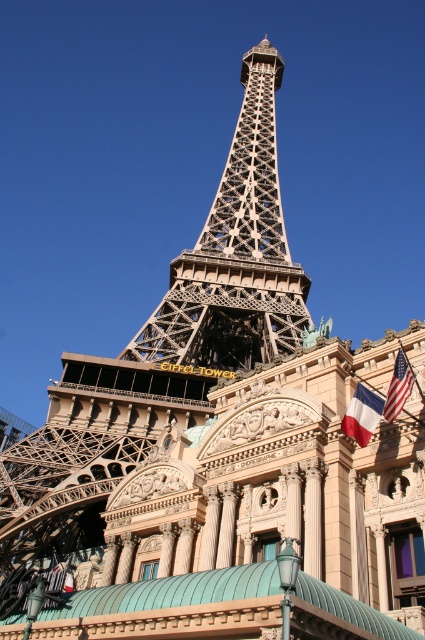
Does metallic lattice structure at center appear under american flag at upper right?

No, metallic lattice structure at center is not below american flag at upper right.

From the picture: Does metallic lattice structure at center have a lesser width compared to american flag at upper right?

In fact, metallic lattice structure at center might be wider than american flag at upper right.

Which is behind, point (260, 76) or point (391, 419)?

Positioned behind is point (260, 76).

Where is `metallic lattice structure at center`? This screenshot has height=640, width=425. metallic lattice structure at center is located at coordinates (235, 253).

Does metallic lattice structure at center appear on the left side of red fabric flag at right?

Indeed, metallic lattice structure at center is positioned on the left side of red fabric flag at right.

Who is higher up, metallic lattice structure at center or red fabric flag at right?

metallic lattice structure at center is higher up.

Where is `metallic lattice structure at center`? metallic lattice structure at center is located at coordinates (235, 253).

Where is `metallic lattice structure at center`? The width and height of the screenshot is (425, 640). metallic lattice structure at center is located at coordinates (235, 253).

Can you confirm if red fabric flag at right is smaller than american flag at upper right?

Actually, red fabric flag at right might be larger than american flag at upper right.

Is red fabric flag at right taller than american flag at upper right?

Yes.

Between point (370, 419) and point (410, 387), which one is positioned in front?

Positioned in front is point (410, 387).

At what (x,y) coordinates should I click in order to perform the action: click on red fabric flag at right. Please return your answer as a coordinate pair (x, y). Image resolution: width=425 pixels, height=640 pixels. Looking at the image, I should click on (362, 413).